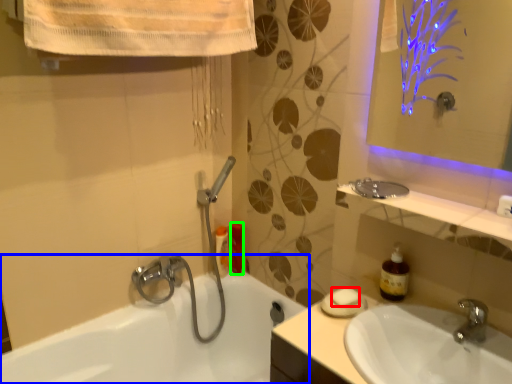
Question: Estimate the real-world distances between objects in this image. Which object is farther from soap (highlighted by a red box), bathtub (highlighted by a blue box) or toiletry (highlighted by a green box)?

Choices:
 (A) bathtub
 (B) toiletry

Answer: (A)